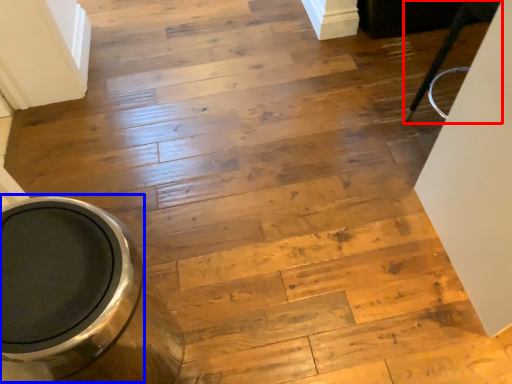
Question: Which of the following is the closest to the observer, furniture (highlighted by a red box) or toilet bowl (highlighted by a blue box)?

Choices:
 (A) furniture
 (B) toilet bowl

Answer: (B)